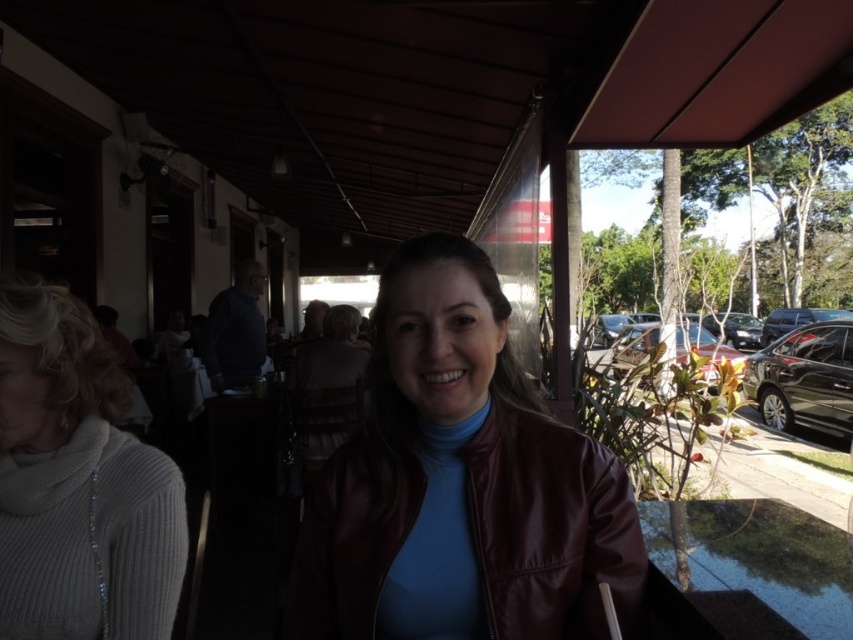
Between burgundy leather jacket at center and transparent glass table at lower right, which one is positioned higher?

burgundy leather jacket at center

Does burgundy leather jacket at center have a lesser height compared to transparent glass table at lower right?

In fact, burgundy leather jacket at center may be taller than transparent glass table at lower right.

Is point (596, 536) farther from viewer compared to point (679, 536)?

No, it is not.

You are a GUI agent. You are given a task and a screenshot of the screen. Output one action in this format:
    pyautogui.click(x=<x>, y=<y>)
    Task: Click on the burgundy leather jacket at center
    The width and height of the screenshot is (853, 640).
    Given the screenshot: What is the action you would take?
    pyautogui.click(x=459, y=483)

Is transparent glass table at lower right below black glossy car at right?

No, transparent glass table at lower right is not below black glossy car at right.

Which is in front, point (764, 561) or point (817, 410)?

Point (764, 561) is in front.

Who is more forward, (750,630) or (834,364)?

Point (750,630) is in front.

Locate an element on the screen. transparent glass table at lower right is located at coordinates (x=744, y=572).

Does burgundy leather jacket at center have a lesser width compared to black glossy car at right?

Yes, burgundy leather jacket at center is thinner than black glossy car at right.

Does point (413, 264) come in front of point (807, 364)?

Yes, point (413, 264) is closer to viewer.

In order to click on burgundy leather jacket at center in this screenshot , I will do `click(459, 483)`.